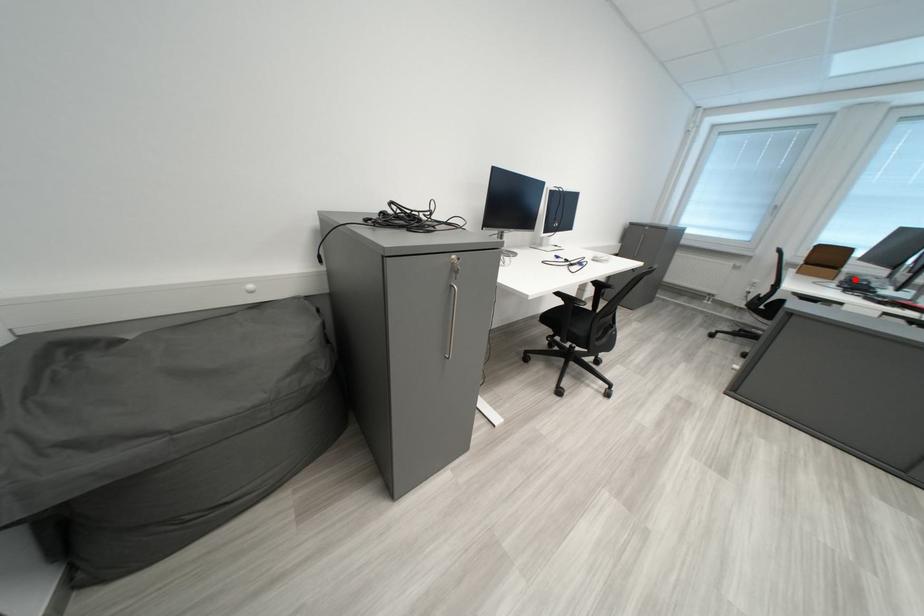
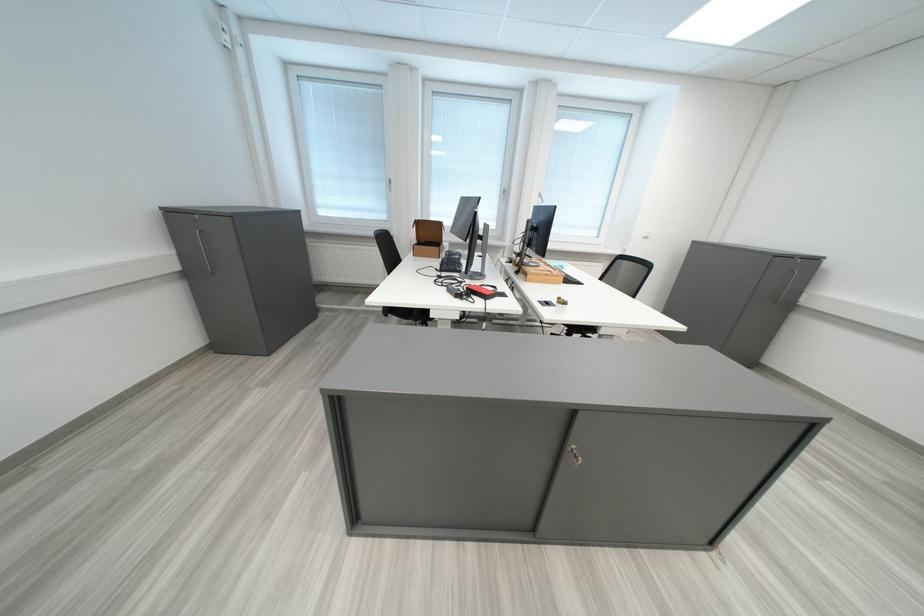
Question: I am providing you with two images of the same scene from different viewpoints. A red point is shown in image1. For the corresponding object point in image2, is it positioned nearer or farther from the camera?

Choices:
 (A) Nearer
 (B) Farther

Answer: (A)